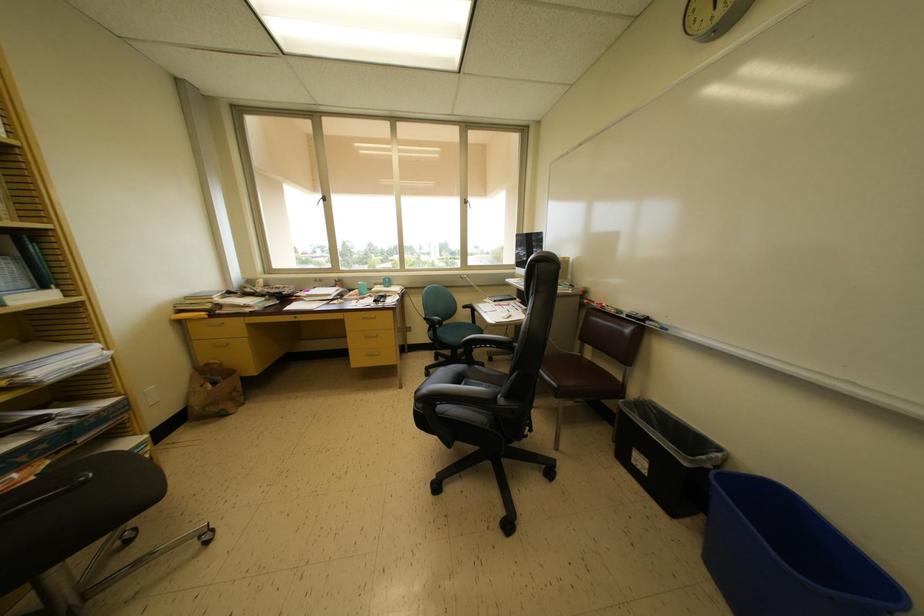
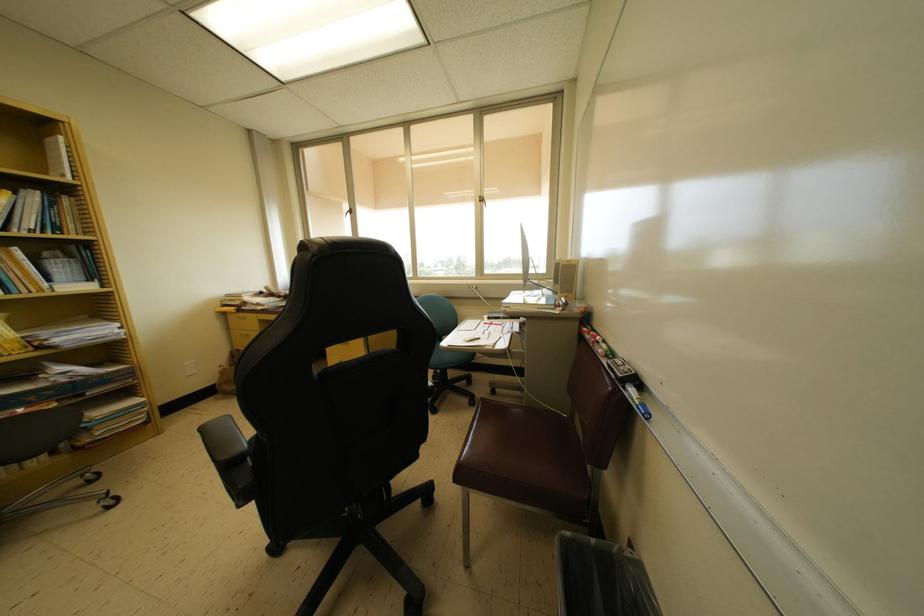
Where in the second image is the point corresponding to point (568, 264) from the first image?

(572, 265)